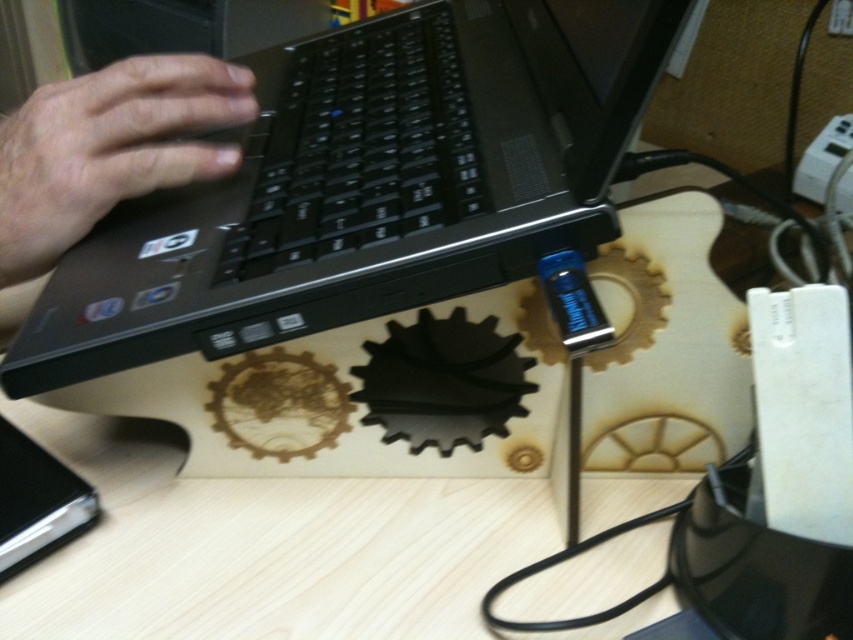
You are trying to reach for the black plastic laptop at center while your hand is at the position of the skinny white hand at left. Will your hand be able to reach the laptop without moving your body?

The black plastic laptop at center is to the right of the skinny white hand at left, so yes, the hand can reach it by extending towards the right.